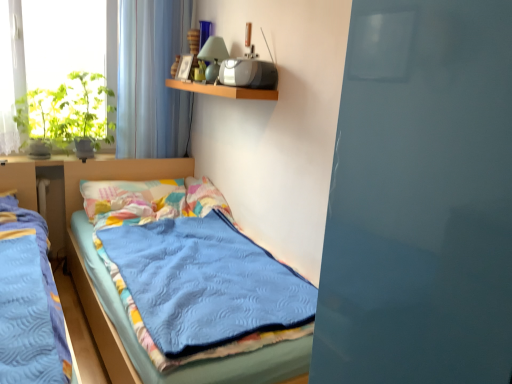
What do you see at coordinates (152, 79) in the screenshot?
I see `translucent fabric curtain at upper left` at bounding box center [152, 79].

What do you see at coordinates (213, 57) in the screenshot?
I see `matte green glass lamp at upper center` at bounding box center [213, 57].

Image resolution: width=512 pixels, height=384 pixels. Find the location of `matte green glass lamp at upper center`. matte green glass lamp at upper center is located at coordinates (213, 57).

Where is `green leafy plant at left, arranged as the second plant when viewed from the left`? The width and height of the screenshot is (512, 384). green leafy plant at left, arranged as the second plant when viewed from the left is located at coordinates (87, 109).

Locate an element on the screen. The image size is (512, 384). wooden shelf at upper center is located at coordinates (223, 90).

From the picture: Who is shorter, multicolored fabric pillow at center or translucent fabric curtain at upper left?

Standing shorter between the two is multicolored fabric pillow at center.

Is multicolored fabric pillow at center facing away from translucent fabric curtain at upper left?

multicolored fabric pillow at center does not have its back to translucent fabric curtain at upper left.

Can you tell me how much multicolored fabric pillow at center and translucent fabric curtain at upper left differ in facing direction?

The angle between the facing direction of multicolored fabric pillow at center and the facing direction of translucent fabric curtain at upper left is 0.131 degrees.

Which object is more forward, multicolored fabric pillow at center or translucent fabric curtain at upper left?

multicolored fabric pillow at center is more forward.

Is multicolored fabric pillow at center positioned far away from green leafy plant at left, arranged as the second plant when viewed from the left?

No, there isn't a large distance between multicolored fabric pillow at center and green leafy plant at left, arranged as the second plant when viewed from the left.

Identify the location of the 2nd plant behind when counting from the multicolored fabric pillow at center. (87, 109).

Choose the correct answer: Is multicolored fabric pillow at center inside green leafy plant at left, the first plant viewed from the right, or outside it?

multicolored fabric pillow at center is not inside green leafy plant at left, the first plant viewed from the right, it's outside.

Which of these two, blue quilted bed at center or green leafy plant at left, the 1th plant viewed from the left, is bigger?

blue quilted bed at center is bigger.

Is blue quilted bed at center positioned with its back to green leafy plant at left, the second plant in the right-to-left sequence?

That's not correct — blue quilted bed at center is not looking away from green leafy plant at left, the second plant in the right-to-left sequence.

In the scene shown: Does blue quilted bed at center touch green leafy plant at left, the 1th plant viewed from the left?

No.

Considering the relative sizes of blue quilted bed at center and green leafy plant at left, the second plant in the right-to-left sequence, in the image provided, is blue quilted bed at center shorter than green leafy plant at left, the second plant in the right-to-left sequence,?

No.

Which is in front, point (106, 111) or point (159, 134)?

Positioned in front is point (106, 111).

Are green leafy plant at left, the first plant viewed from the right, and translucent fabric curtain at upper left located far from each other?

No, green leafy plant at left, the first plant viewed from the right, is not far away from translucent fabric curtain at upper left.

Considering the positions of objects green leafy plant at left, the first plant viewed from the right, and translucent fabric curtain at upper left in the image provided, who is more to the left, green leafy plant at left, the first plant viewed from the right, or translucent fabric curtain at upper left?

Positioned to the left is green leafy plant at left, the first plant viewed from the right.

Is green leafy plant at left, the first plant viewed from the right, oriented towards translucent fabric curtain at upper left?

No, green leafy plant at left, the first plant viewed from the right, is not turned towards translucent fabric curtain at upper left.

From the image's perspective, is translucent fabric curtain at upper left over wooden shelf at upper center?

Correct, translucent fabric curtain at upper left appears higher than wooden shelf at upper center in the image.

From a real-world perspective, which object rests below the other?

wooden shelf at upper center, from a real-world perspective.

Is translucent fabric curtain at upper left at the left side of wooden shelf at upper center?

Indeed, translucent fabric curtain at upper left is positioned on the left side of wooden shelf at upper center.

Is wooden shelf at upper center completely or partially inside translucent fabric curtain at upper left?

No.

Considering the relative sizes of wooden shelf at upper center and translucent fabric curtain at upper left in the image provided, is wooden shelf at upper center taller than translucent fabric curtain at upper left?

No, wooden shelf at upper center is not taller than translucent fabric curtain at upper left.

From the picture: Is translucent fabric curtain at upper left surrounded by wooden shelf at upper center?

No, translucent fabric curtain at upper left is not surrounded by wooden shelf at upper center.

Is wooden shelf at upper center positioned with its back to translucent fabric curtain at upper left?

wooden shelf at upper center does not have its back to translucent fabric curtain at upper left.

From the image's perspective, would you say transparent glass window at upper left is shown under blue quilted bed at center?

A: No, from the image's perspective, transparent glass window at upper left is not beneath blue quilted bed at center.

Measure the distance between transparent glass window at upper left and blue quilted bed at center.

A distance of 4.14 feet exists between transparent glass window at upper left and blue quilted bed at center.

Based on the photo, which is in front, transparent glass window at upper left or blue quilted bed at center?

blue quilted bed at center is closer to the camera.

Can you confirm if transparent glass window at upper left is positioned to the right of blue quilted bed at center?

No, transparent glass window at upper left is not to the right of blue quilted bed at center.

You are a GUI agent. You are given a task and a screenshot of the screen. Output one action in this format:
    pyautogui.click(x=<x>, y=<y>)
    Task: Click on the curtain on the right of multicolored fabric pillow at center
    Image resolution: width=512 pixels, height=384 pixels.
    Given the screenshot: What is the action you would take?
    pyautogui.click(x=152, y=79)

Identify the location of the 2nd plant above when counting from the multicolored fabric pillow at center (from the image's perspective). The image size is (512, 384). (87, 109).

Looking at the image, which one is located closer to green leafy plant at left, the second plant in the right-to-left sequence, blue quilted bed at center or wooden shelf at upper center?

wooden shelf at upper center lies closer to green leafy plant at left, the second plant in the right-to-left sequence, than the other object.

Based on the photo, estimate the real-world distances between objects in this image. Which object is further from blue quilted bed at center, wooden shelf at upper center or matte green glass lamp at upper center?

The object further to blue quilted bed at center is matte green glass lamp at upper center.

Looking at the image, which one is located closer to matte green glass lamp at upper center, blue quilted bed at center or multicolored fabric pillow at center?

The object closer to matte green glass lamp at upper center is multicolored fabric pillow at center.

From the image, which object appears to be nearer to blue quilted bed at center, wooden shelf at upper center or transparent glass window at upper left?

transparent glass window at upper left lies closer to blue quilted bed at center than the other object.

Looking at the image, which one is located further to multicolored fabric pillow at center, blue quilted bed at center or transparent glass window at upper left?

transparent glass window at upper left is positioned further to the anchor multicolored fabric pillow at center.

Estimate the real-world distances between objects in this image. Which object is further from blue quilted bed at center, matte green glass lamp at upper center or green leafy plant at left, the first plant viewed from the right?

Among the two, matte green glass lamp at upper center is located further to blue quilted bed at center.

Considering their positions, is wooden shelf at upper center positioned further to matte green glass lamp at upper center than green leafy plant at left, the 1th plant viewed from the left?

Based on the image, green leafy plant at left, the 1th plant viewed from the left, appears to be further to matte green glass lamp at upper center.

Based on their spatial positions, is transparent glass window at upper left or wooden shelf at upper center closer to green leafy plant at left, the 1th plant viewed from the left?

transparent glass window at upper left is closer to green leafy plant at left, the 1th plant viewed from the left.

What are the coordinates of `window located between green leafy plant at left, the 1th plant viewed from the left, and translucent fabric curtain at upper left in the left-right direction` in the screenshot? It's located at (103, 81).

At what (x,y) coordinates should I click in order to perform the action: click on window positioned between blue quilted bed at center and green leafy plant at left, the second plant in the right-to-left sequence, from near to far. Please return your answer as a coordinate pair (x, y). This screenshot has height=384, width=512. Looking at the image, I should click on (103, 81).

At what (x,y) coordinates should I click in order to perform the action: click on shelf between blue quilted bed at center and multicolored fabric pillow at center from front to back. Please return your answer as a coordinate pair (x, y). This screenshot has width=512, height=384. Looking at the image, I should click on 223,90.

Locate an element on the screen. plant between green leafy plant at left, the 1th plant viewed from the left, and translucent fabric curtain at upper left is located at coordinates (87, 109).